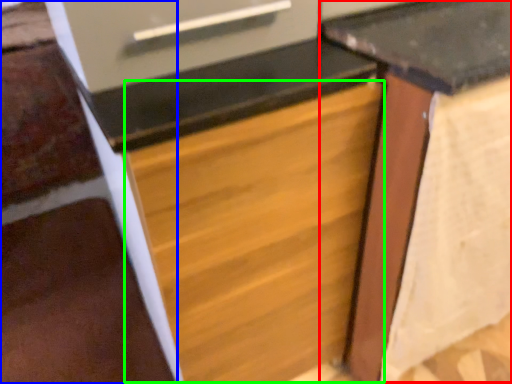
Question: Which is farther away from table (highlighted by a red box)? stairwell (highlighted by a blue box) or drawer (highlighted by a green box)?

Choices:
 (A) stairwell
 (B) drawer

Answer: (A)